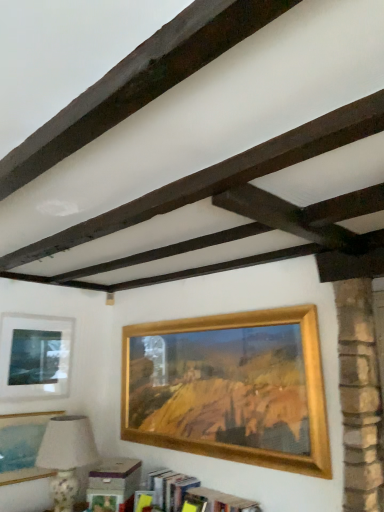
Question: Can you confirm if gold wooden picture frame at center, marked as the 3th picture frame in a left-to-right arrangement, is thinner than porcelain floral table lamp at lower left?

Choices:
 (A) no
 (B) yes

Answer: (B)

Question: Does gold wooden picture frame at center, marked as the 3th picture frame in a left-to-right arrangement, turn towards porcelain floral table lamp at lower left?

Choices:
 (A) no
 (B) yes

Answer: (B)

Question: Can you confirm if gold wooden picture frame at center, marked as the 3th picture frame in a left-to-right arrangement, is positioned to the left of porcelain floral table lamp at lower left?

Choices:
 (A) yes
 (B) no

Answer: (B)

Question: Is gold wooden picture frame at center, marked as the first picture frame in a right-to-left arrangement, turned away from porcelain floral table lamp at lower left?

Choices:
 (A) no
 (B) yes

Answer: (A)

Question: Can you confirm if gold wooden picture frame at center, marked as the first picture frame in a right-to-left arrangement, is smaller than porcelain floral table lamp at lower left?

Choices:
 (A) yes
 (B) no

Answer: (A)

Question: Can you confirm if gold wooden picture frame at center, marked as the 3th picture frame in a left-to-right arrangement, is positioned to the right of porcelain floral table lamp at lower left?

Choices:
 (A) yes
 (B) no

Answer: (A)

Question: Is wooden bookshelf at lower center not inside gold wooden picture frame at center, marked as the first picture frame in a right-to-left arrangement?

Choices:
 (A) no
 (B) yes

Answer: (B)

Question: Does wooden bookshelf at lower center have a greater width compared to gold wooden picture frame at center, marked as the first picture frame in a right-to-left arrangement?

Choices:
 (A) no
 (B) yes

Answer: (B)

Question: Can you confirm if wooden bookshelf at lower center is smaller than gold wooden picture frame at center, marked as the 3th picture frame in a left-to-right arrangement?

Choices:
 (A) yes
 (B) no

Answer: (A)

Question: Is wooden bookshelf at lower center thinner than gold wooden picture frame at center, marked as the 3th picture frame in a left-to-right arrangement?

Choices:
 (A) no
 (B) yes

Answer: (A)

Question: Is the depth of wooden bookshelf at lower center greater than that of gold wooden picture frame at center, marked as the 3th picture frame in a left-to-right arrangement?

Choices:
 (A) no
 (B) yes

Answer: (B)

Question: Can you confirm if wooden bookshelf at lower center is taller than gold wooden picture frame at center, marked as the first picture frame in a right-to-left arrangement?

Choices:
 (A) no
 (B) yes

Answer: (A)

Question: Is porcelain floral table lamp at lower left at the back of matte glass picture frame at upper left, the 1th picture frame from the left?

Choices:
 (A) no
 (B) yes

Answer: (A)